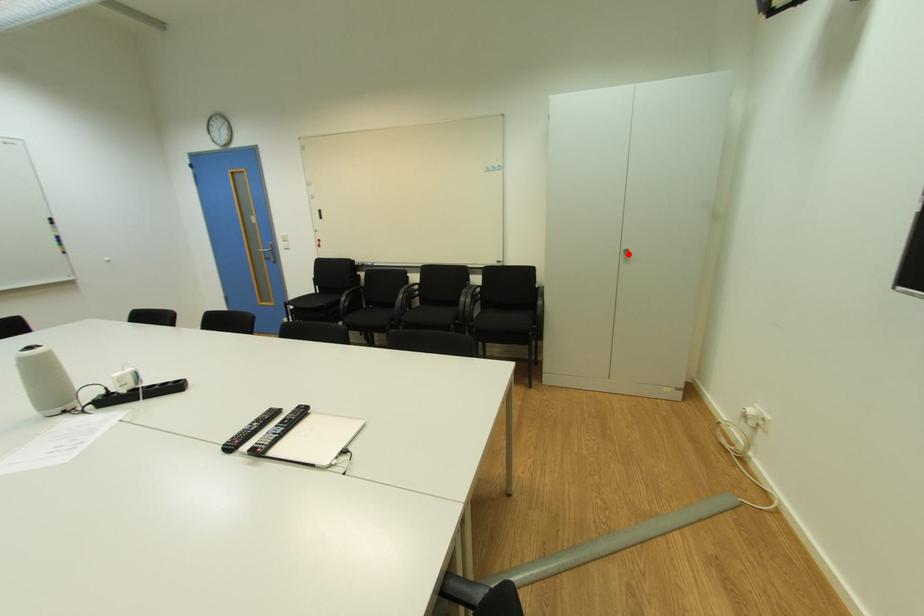
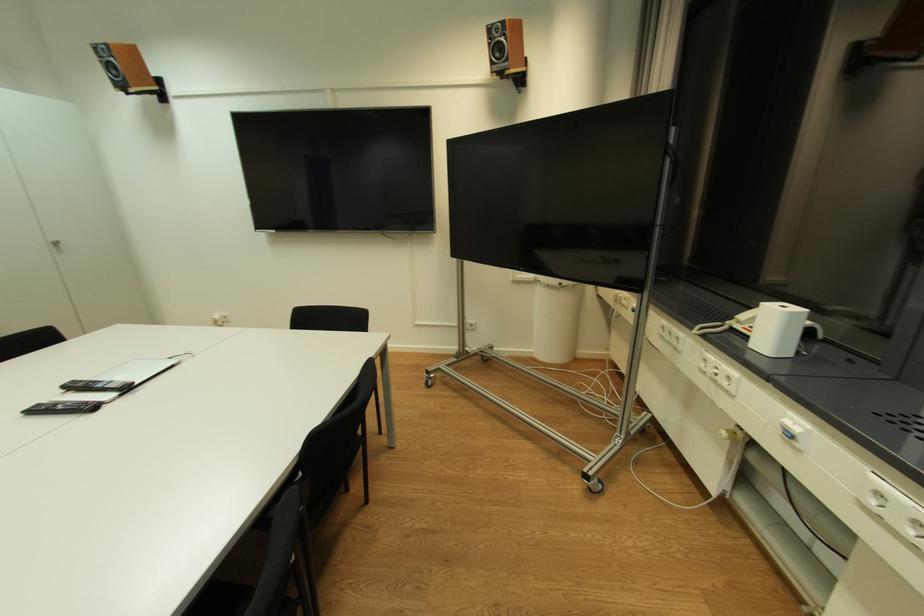
The point at the highlighted location is marked in the first image. Where is the corresponding point in the second image?

(57, 246)